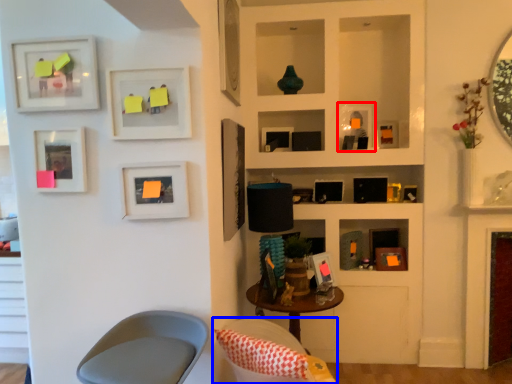
Question: Among these objects, which one is farthest to the camera, picture frame (highlighted by a red box) or chair (highlighted by a blue box)?

Choices:
 (A) picture frame
 (B) chair

Answer: (A)